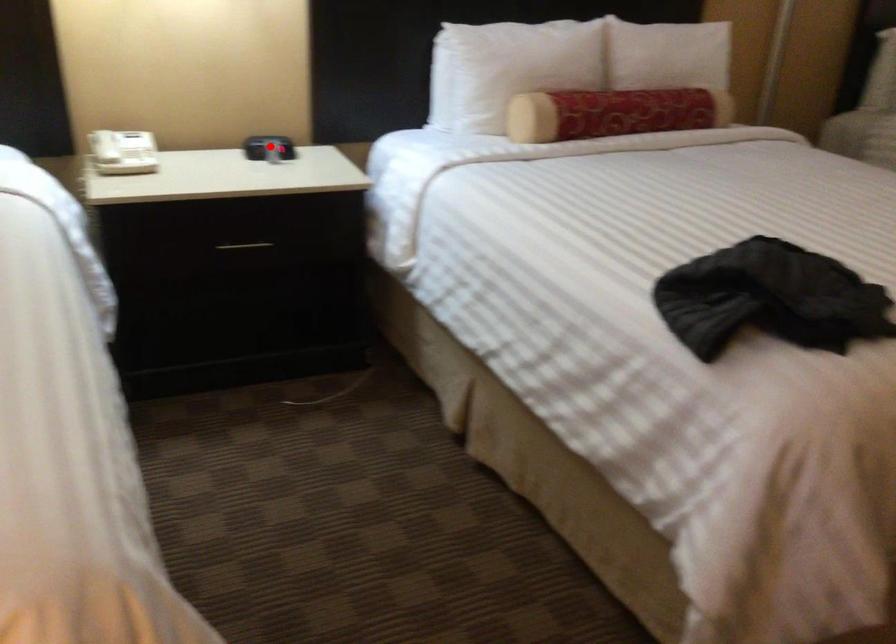
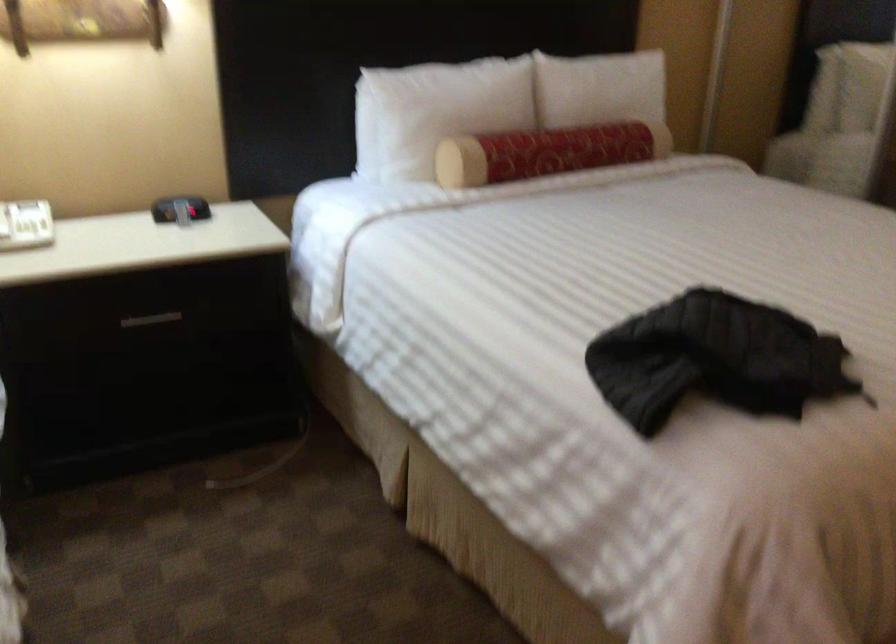
Where in the second image is the point corresponding to the highlighted location from the first image?

(179, 209)